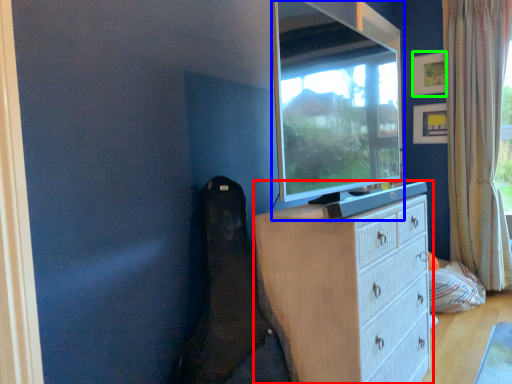
Question: Based on their relative distances, which object is nearer to chest of drawers (highlighted by a red box)? Choose from television (highlighted by a blue box) and picture frame (highlighted by a green box).

Choices:
 (A) television
 (B) picture frame

Answer: (A)